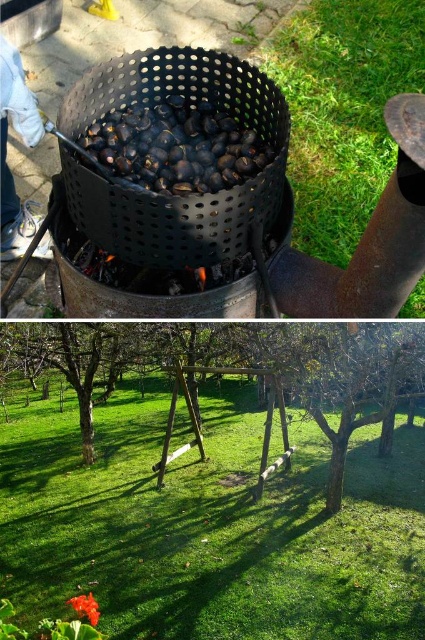
Question: Does black matte chestnuts at center appear over smooth glossy flower at lower left?

Choices:
 (A) no
 (B) yes

Answer: (B)

Question: Is black matte chestnuts at center to the right of smooth glossy flower at lower left from the viewer's perspective?

Choices:
 (A) yes
 (B) no

Answer: (A)

Question: Observing the image, what is the correct spatial positioning of black matte chestnuts at center in reference to smooth glossy flower at lower left?

Choices:
 (A) above
 (B) below

Answer: (A)